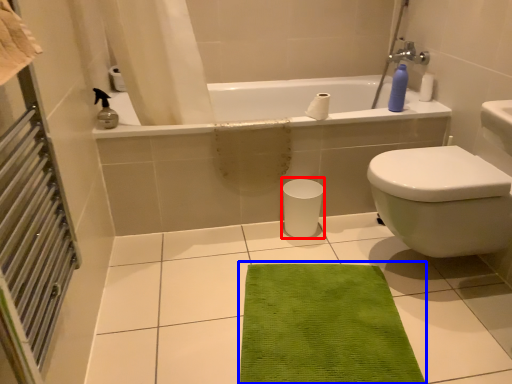
Question: Among these objects, which one is nearest to the camera, porcelain (highlighted by a red box) or doormat (highlighted by a blue box)?

Choices:
 (A) porcelain
 (B) doormat

Answer: (B)